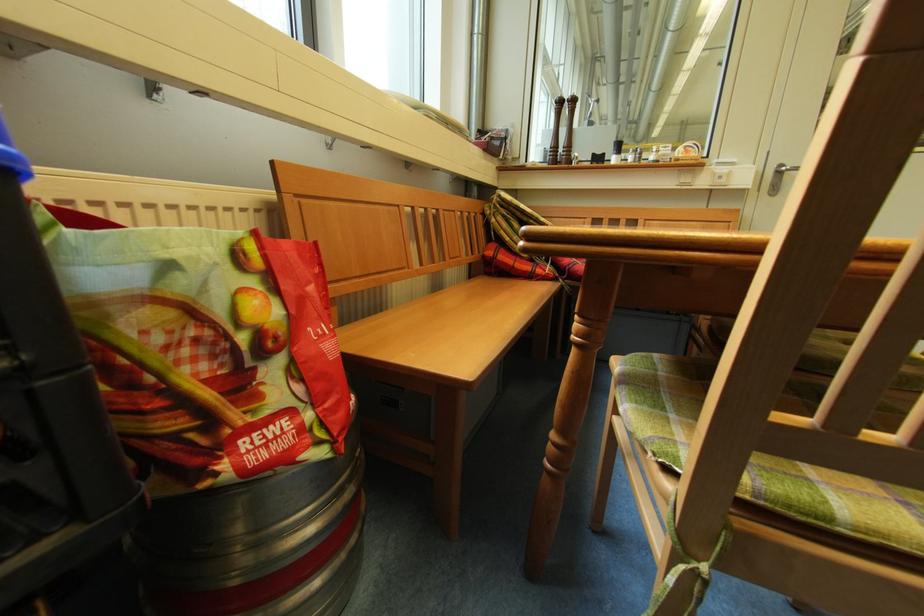
What do you see at coordinates (455, 325) in the screenshot? This screenshot has width=924, height=616. I see `the wooden bench sitting surface` at bounding box center [455, 325].